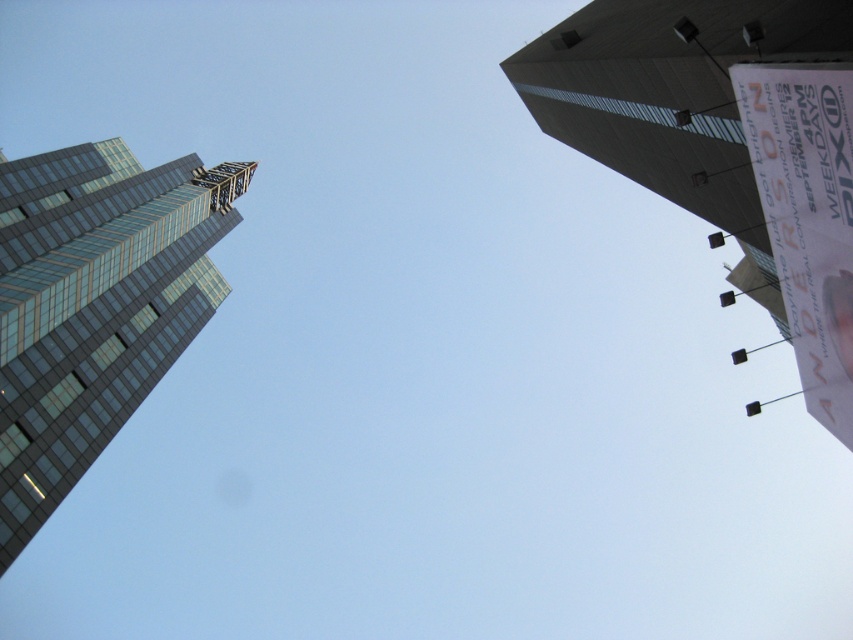
Does smooth concrete tower at upper right lie behind glassy steel skyscraper at left?

That is False.

Which is more to the right, smooth concrete tower at upper right or glassy steel skyscraper at left?

smooth concrete tower at upper right is more to the right.

Locate an element on the screen. The width and height of the screenshot is (853, 640). smooth concrete tower at upper right is located at coordinates (726, 141).